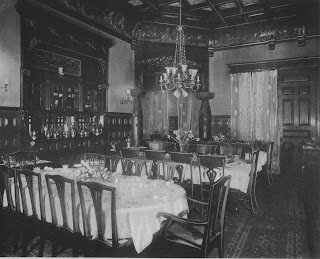
You are a GUI agent. You are given a task and a screenshot of the screen. Output one action in this format:
    pyautogui.click(x=<x>, y=<y>)
    Task: Click on the rug
    The height and width of the screenshot is (259, 320).
    Given the screenshot: What is the action you would take?
    pyautogui.click(x=240, y=232)